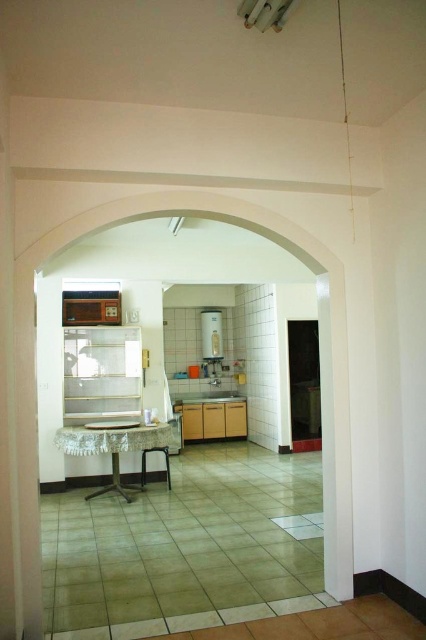
Question: From the image, what is the correct spatial relationship of white lace table at center in relation to white glossy refrigerator at center?

Choices:
 (A) right
 (B) left

Answer: (B)

Question: Which object appears farthest from the camera in this image?

Choices:
 (A) white lace table at center
 (B) white glossy refrigerator at center

Answer: (B)

Question: Does white lace table at center have a smaller size compared to white glossy refrigerator at center?

Choices:
 (A) no
 (B) yes

Answer: (A)

Question: Which of the following is the farthest from the observer?

Choices:
 (A) pyautogui.click(x=167, y=467)
 (B) pyautogui.click(x=215, y=358)

Answer: (B)

Question: Is white lace table at center closer to camera compared to white glossy refrigerator at center?

Choices:
 (A) no
 (B) yes

Answer: (B)

Question: Among these points, which one is farthest from the camera?

Choices:
 (A) (112, 438)
 (B) (204, 333)

Answer: (B)